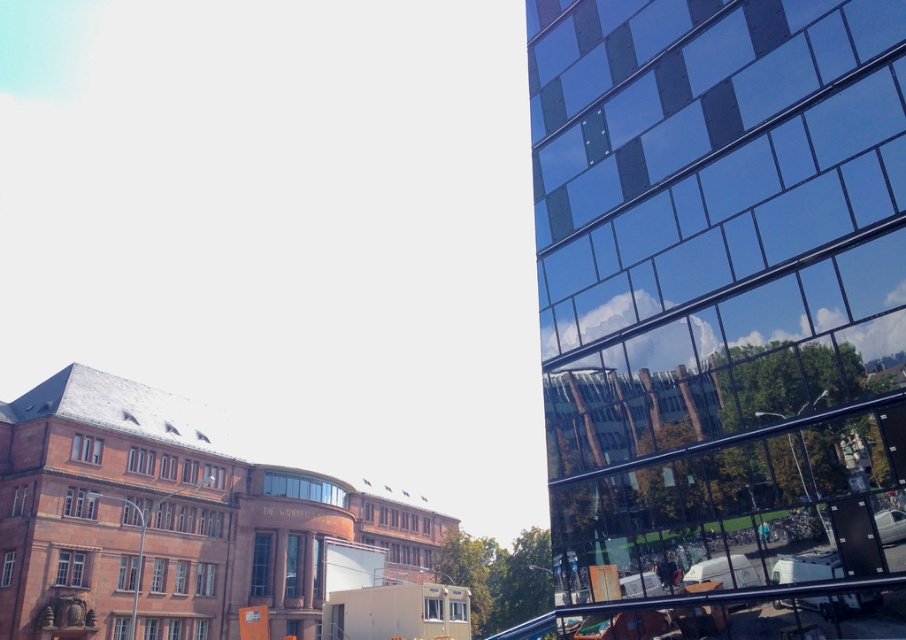
Image resolution: width=906 pixels, height=640 pixels. I want to click on reflective glass building at right, so click(x=719, y=298).

Is reflective glass building at right wider than black glossy rail at lower right?

Correct, the width of reflective glass building at right exceeds that of black glossy rail at lower right.

Is point (715, 356) closer to viewer compared to point (811, 588)?

No, it is behind (811, 588).

You are a GUI agent. You are given a task and a screenshot of the screen. Output one action in this format:
    pyautogui.click(x=<x>, y=<y>)
    Task: Click on the reflective glass building at right
    The height and width of the screenshot is (640, 906).
    Given the screenshot: What is the action you would take?
    pyautogui.click(x=719, y=298)